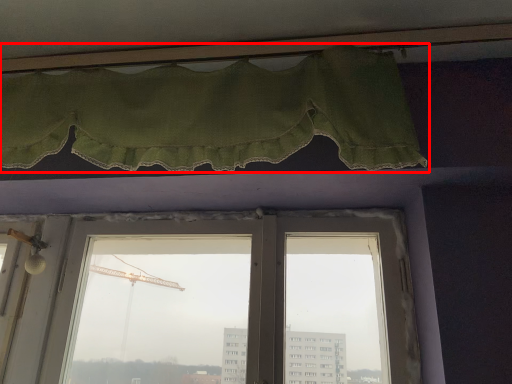
Question: From the image's perspective, what is the correct spatial relationship of curtain (annotated by the red box) in relation to window?

Choices:
 (A) above
 (B) below

Answer: (A)